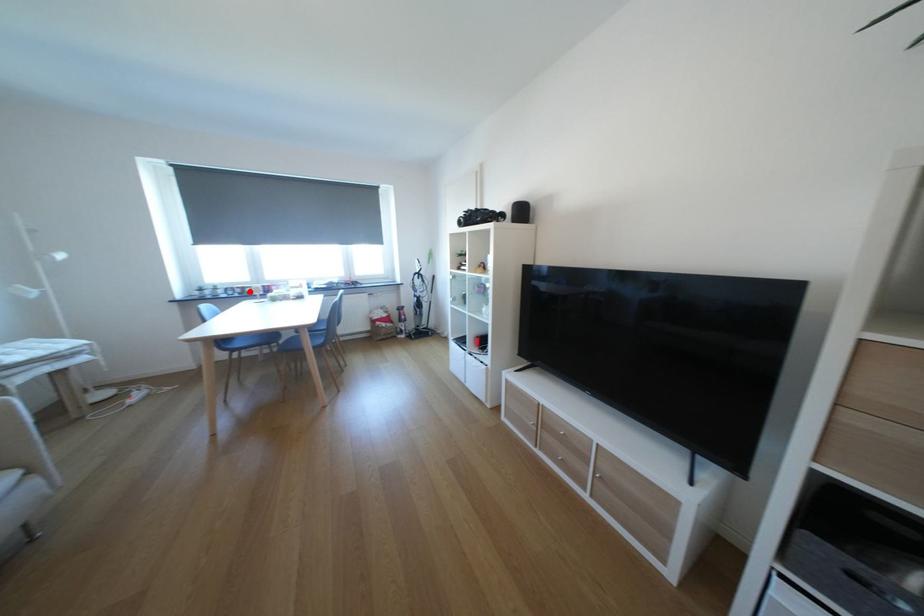
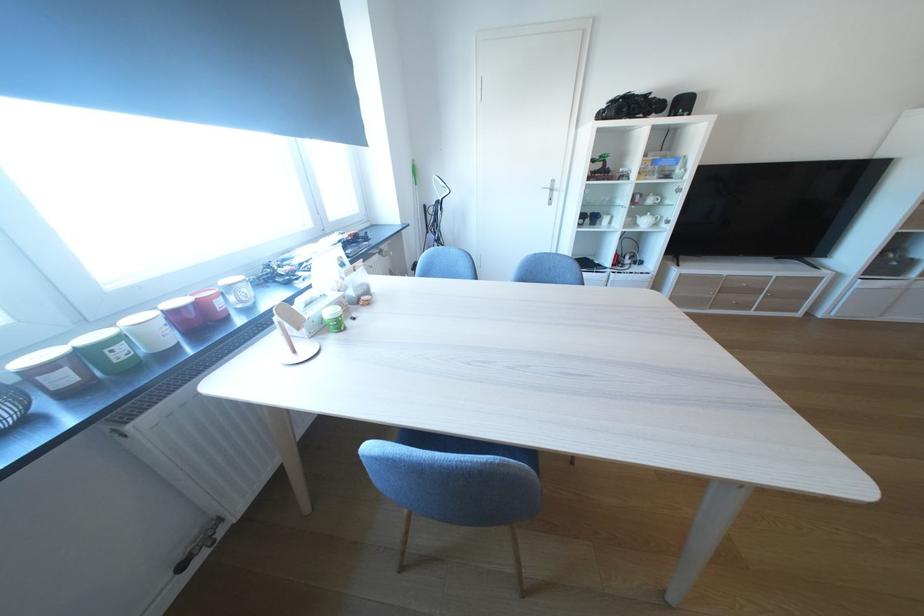
In the second image, find the point that corresponds to the highlighted location in the first image.

(75, 379)